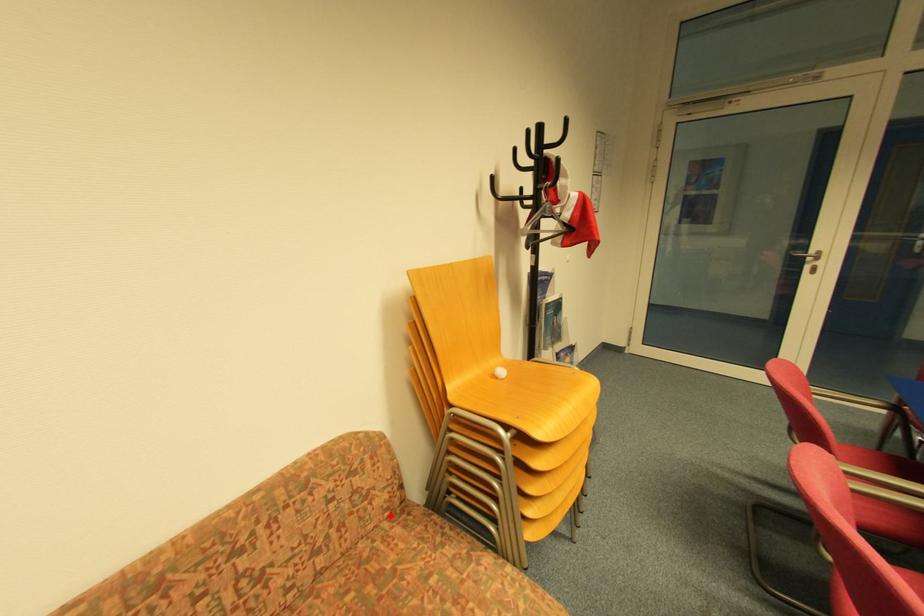
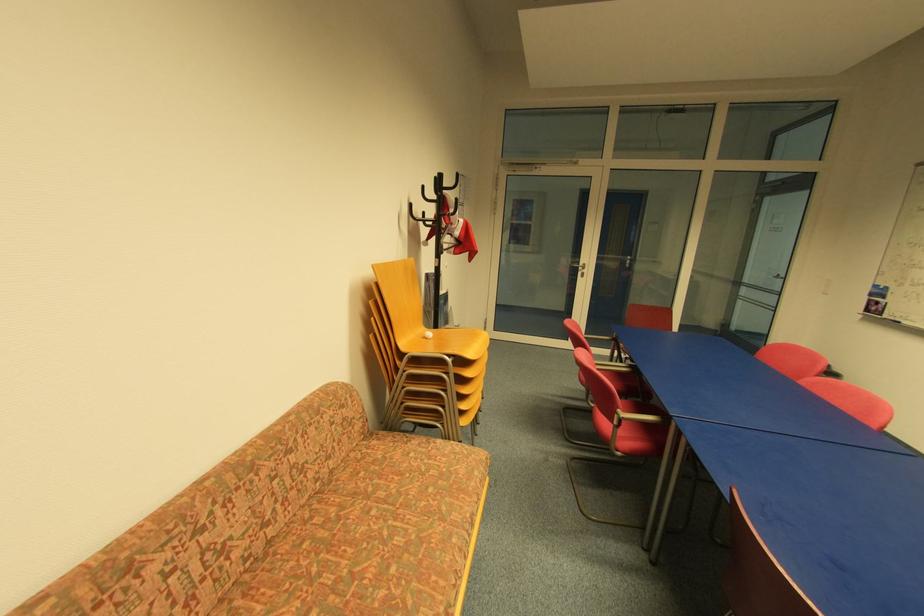
Question: I am providing you with two images of the same scene from different viewpoints. A red point is shown in image1. For the corresponding object point in image2, is it positioned nearer or farther from the camera?

Choices:
 (A) Nearer
 (B) Farther

Answer: (A)